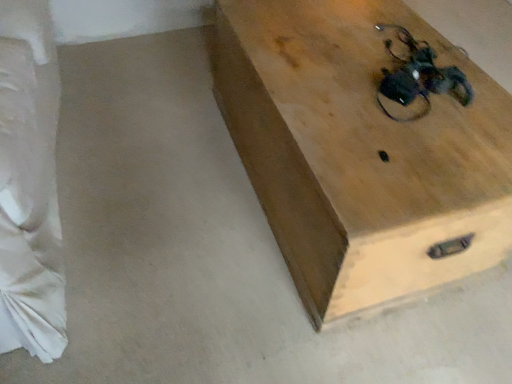
I want to click on vacant area situated to the left side of natural wood chest at upper right, so click(159, 194).